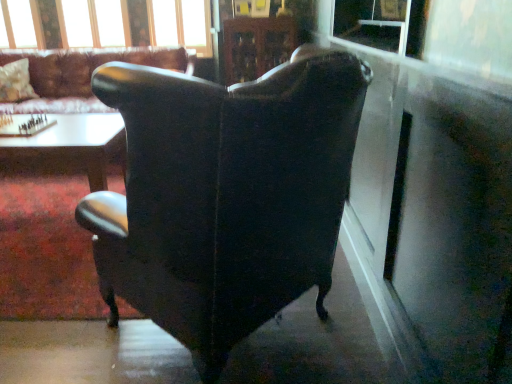
Question: Looking at their shapes, would you say white glossy table at lower left, which is the 1th table from bottom to top, is wider or thinner than fluffy white pillow at upper left?

Choices:
 (A) thin
 (B) wide

Answer: (B)

Question: Is point (26, 177) positioned closer to the camera than point (25, 84)?

Choices:
 (A) closer
 (B) farther

Answer: (A)

Question: Which object is the farthest from the wooden chessboard at center?

Choices:
 (A) white glossy table at lower left, which is the 1th table from bottom to top
 (B) fluffy white pillow at upper left
 (C) matte black wingback chair at center, marked as the 2th chair in a top-to-bottom arrangement
 (D) wooden glossy table at center, which is the 1th table from top to bottom
 (E) matte black wingback chair at center, which is the second chair in bottom-to-top order

Answer: (C)

Question: Which is nearer to the white glossy table at lower left, which is the 1th table from bottom to top?

Choices:
 (A) matte black wingback chair at center, which is the first chair from top to bottom
 (B) transparent plastic window screen at upper right
 (C) wooden glossy table at center, which is the second table from bottom to top
 (D) matte black wingback chair at center, the 1th chair in the front-to-back sequence
 (E) clear glass window frame at upper center

Answer: (C)